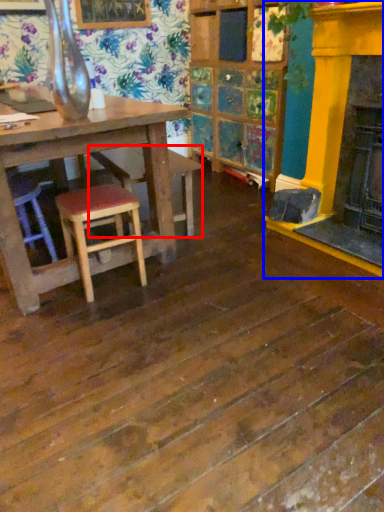
Question: Which point is closer to the camera, bar stool (highlighted by a red box) or fireplace (highlighted by a blue box)?

Choices:
 (A) bar stool
 (B) fireplace

Answer: (B)